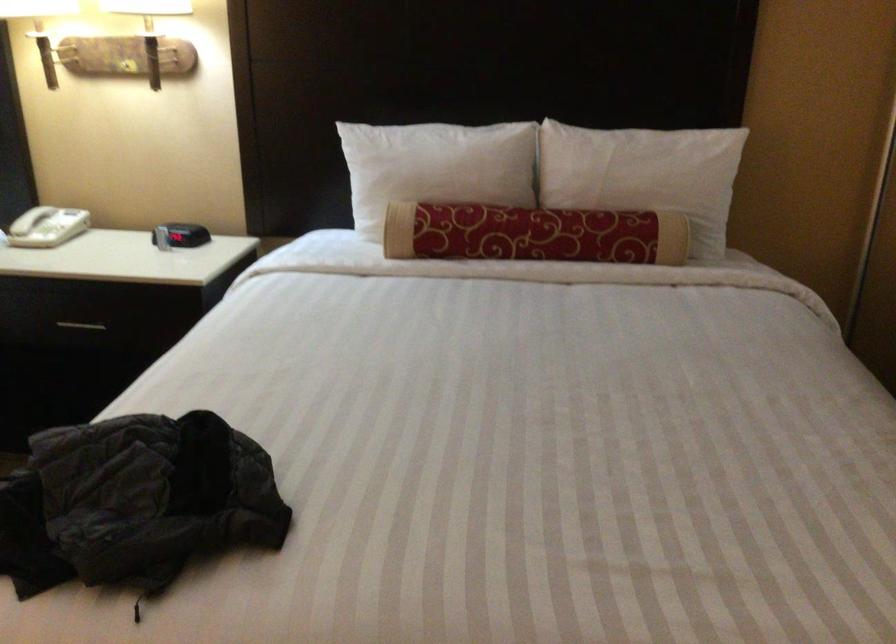
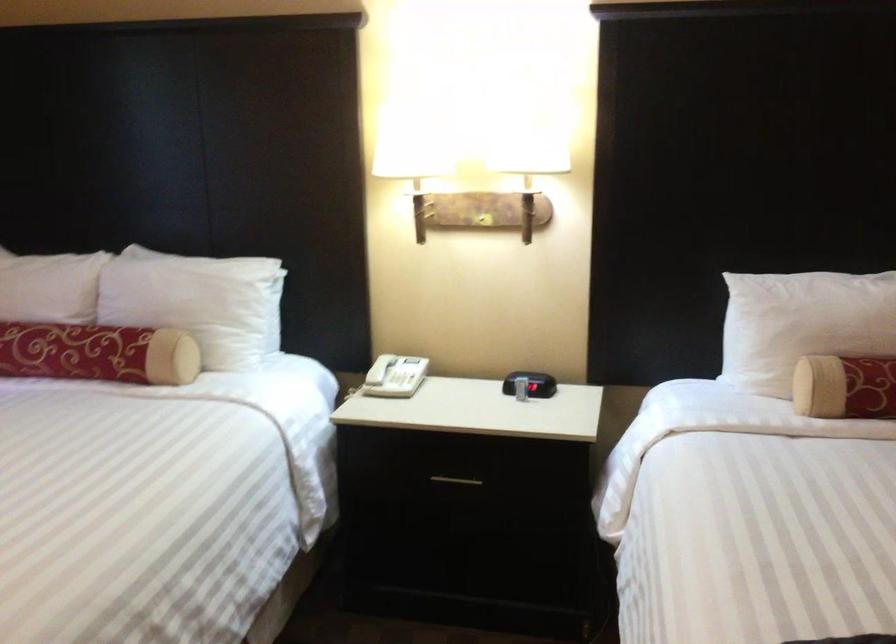
The point at (391, 176) is marked in the first image. Where is the corresponding point in the second image?

(802, 324)